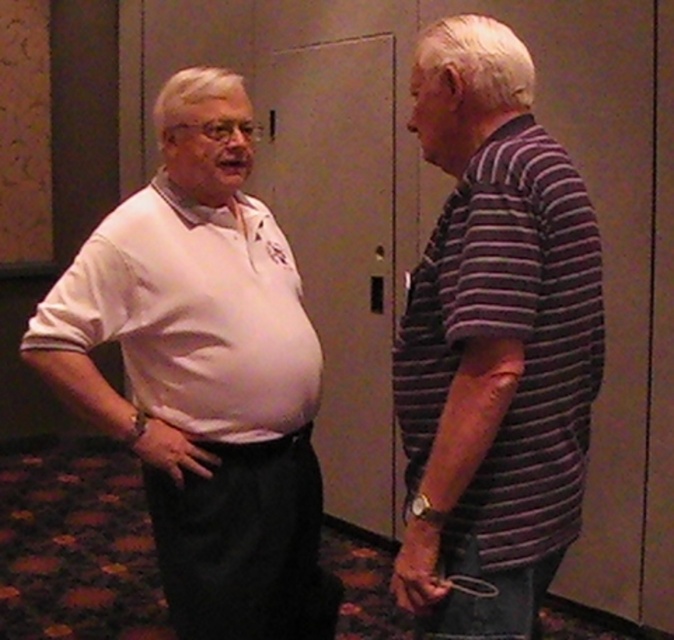
Can you confirm if white matte shirt at left is smaller than striped cotton shirt at right?

Actually, white matte shirt at left might be larger than striped cotton shirt at right.

Does white matte shirt at left appear over striped cotton shirt at right?

Incorrect, white matte shirt at left is not positioned above striped cotton shirt at right.

Does point (187, 490) lie in front of point (429, 65)?

No, (187, 490) is further to viewer.

This screenshot has height=640, width=674. What are the coordinates of `white matte shirt at left` in the screenshot? It's located at (204, 372).

Does white matte shirt at left have a lesser height compared to white matte polo shirt at left?

In fact, white matte shirt at left may be taller than white matte polo shirt at left.

Does white matte shirt at left appear under white matte polo shirt at left?

Yes, white matte shirt at left is below white matte polo shirt at left.

Which is in front, point (235, 536) or point (226, 228)?

Point (235, 536)

Identify the location of white matte shirt at left. [204, 372].

Is striped cotton shirt at right bigger than white matte polo shirt at left?

Yes, striped cotton shirt at right is bigger than white matte polo shirt at left.

Is striped cotton shirt at right shorter than white matte polo shirt at left?

No.

I want to click on striped cotton shirt at right, so click(x=493, y=342).